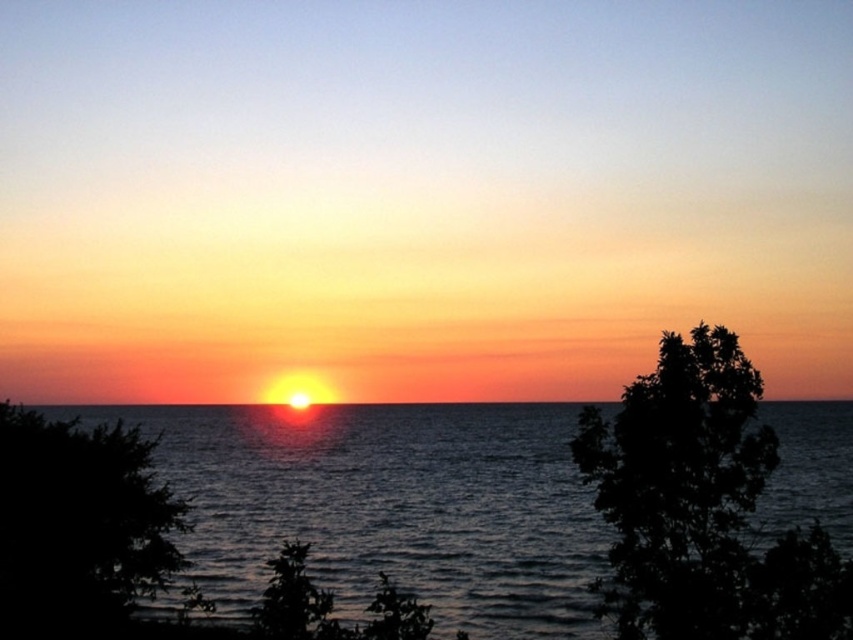
You are a photographer trying to capture the sunset. You notice the glistening blue water at center and the silhouette leafy tree at right. Which object is closer to the horizon line?

The glistening blue water at center is positioned under the silhouette leafy tree at right, meaning the water is closer to the horizon line than the tree.

You are standing at the center of the image and want to take a photo of the silhouette leafy tree at right. Which direction should you move to get a better view of it?

Since the silhouette leafy tree at right is located at point 0.794 on the x and 0.824 on the y coordinate, you should move to your right to get a better view of it.

You are an observer standing at the edge of the water. You see the glistening blue water at center and the dark green leafy tree at lower left. Which object is closer to you?

The glistening blue water at center is closer to you because it is in front of the dark green leafy tree at lower left.